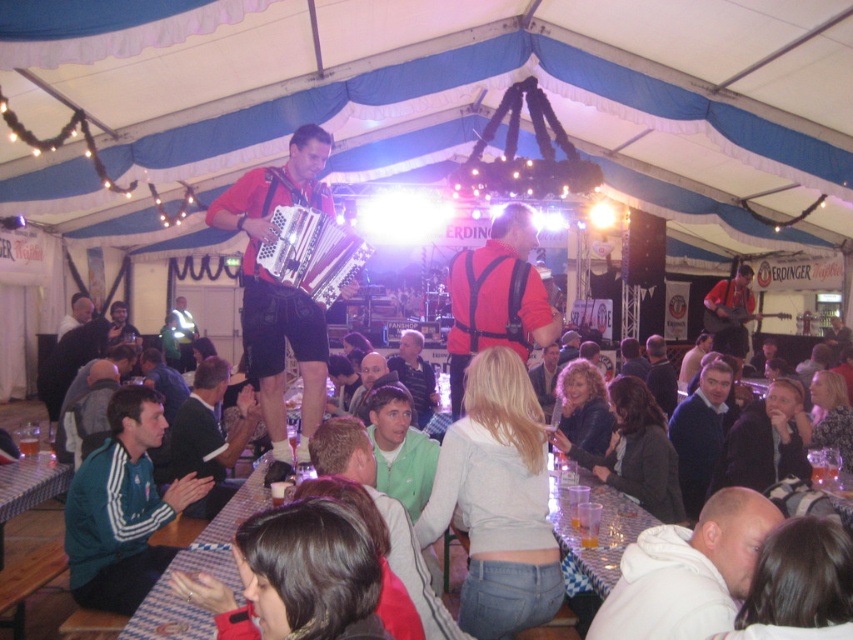
Who is higher up, green fabric jacket at lower left or green matte jacket at center?

Positioned higher is green matte jacket at center.

Where is `green fabric jacket at lower left`? The width and height of the screenshot is (853, 640). green fabric jacket at lower left is located at coordinates (123, 508).

Who is taller, green fabric shirt at lower left or dark blue shirt at center?

green fabric shirt at lower left

Does green fabric shirt at lower left appear under dark blue shirt at center?

Yes.

Is point (212, 387) positioned in front of point (664, 396)?

That is True.

At what (x,y) coordinates should I click in order to perform the action: click on green fabric shirt at lower left. Please return your answer as a coordinate pair (x, y). Image resolution: width=853 pixels, height=640 pixels. Looking at the image, I should click on (209, 435).

Is point (401, 474) more distant than point (660, 390)?

No, (401, 474) is in front of (660, 390).

Based on the photo, does green matte jacket at center appear on the left side of dark blue shirt at center?

Indeed, green matte jacket at center is positioned on the left side of dark blue shirt at center.

Where is `green matte jacket at center`? green matte jacket at center is located at coordinates (399, 449).